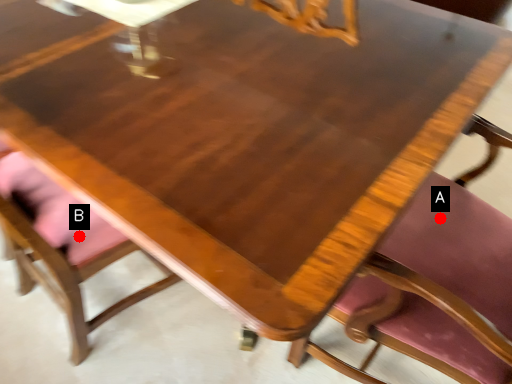
Question: Two points are circled on the image, labeled by A and B beside each circle. Which point is farther to the camera?

Choices:
 (A) A is further
 (B) B is further

Answer: (A)